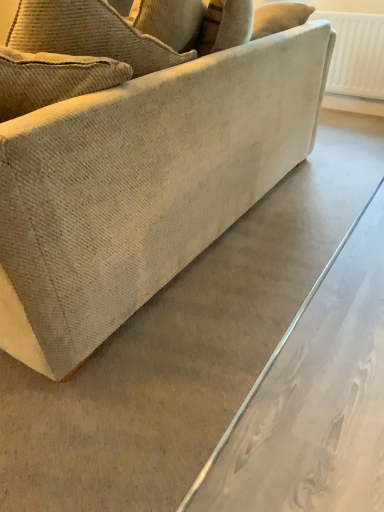
Locate an element on the screen. The width and height of the screenshot is (384, 512). white textured radiator at upper right is located at coordinates (356, 54).

The image size is (384, 512). What do you see at coordinates (356, 54) in the screenshot? I see `white textured radiator at upper right` at bounding box center [356, 54].

The height and width of the screenshot is (512, 384). What are the coordinates of `beige fabric couch at center` in the screenshot? It's located at pyautogui.click(x=142, y=162).

What do you see at coordinates (142, 162) in the screenshot? Image resolution: width=384 pixels, height=512 pixels. I see `beige fabric couch at center` at bounding box center [142, 162].

Image resolution: width=384 pixels, height=512 pixels. What are the coordinates of `white textured radiator at upper right` in the screenshot? It's located at (356, 54).

Can you confirm if beige fabric couch at center is positioned to the right of white textured radiator at upper right?

No.

Which is behind, beige fabric couch at center or white textured radiator at upper right?

white textured radiator at upper right is further from the camera.

Between point (310, 145) and point (381, 69), which one is positioned in front?

Point (310, 145)

From the image's perspective, is beige fabric couch at center under white textured radiator at upper right?

Yes.

From a real-world perspective, between beige fabric couch at center and white textured radiator at upper right, who is vertically lower?

In real-world perspective, white textured radiator at upper right is lower.

Between beige fabric couch at center and white textured radiator at upper right, which one has smaller width?

With smaller width is white textured radiator at upper right.

Can you confirm if beige fabric couch at center is shorter than white textured radiator at upper right?

No.

Does beige fabric couch at center have a smaller size compared to white textured radiator at upper right?

Incorrect, beige fabric couch at center is not smaller in size than white textured radiator at upper right.

Is beige fabric couch at center surrounding white textured radiator at upper right?

That's incorrect, white textured radiator at upper right is not inside beige fabric couch at center.

Is beige fabric couch at center next to white textured radiator at upper right?

beige fabric couch at center and white textured radiator at upper right are clearly separated.

Is beige fabric couch at center turned away from white textured radiator at upper right?

No, beige fabric couch at center's orientation is not away from white textured radiator at upper right.

How different are the orientations of beige fabric couch at center and white textured radiator at upper right in degrees?

The facing directions of beige fabric couch at center and white textured radiator at upper right are 90.9 degrees apart.

How much distance is there between beige fabric couch at center and white textured radiator at upper right?

beige fabric couch at center and white textured radiator at upper right are 5.60 feet apart.

This screenshot has height=512, width=384. I want to click on studio couch to the left of white textured radiator at upper right, so click(x=142, y=162).

Which object is positioned more to the left, white textured radiator at upper right or beige fabric couch at center?

beige fabric couch at center.

Considering the positions of objects white textured radiator at upper right and beige fabric couch at center in the image provided, who is in front, white textured radiator at upper right or beige fabric couch at center?

Positioned in front is beige fabric couch at center.

Does point (375, 52) lie in front of point (93, 197)?

That is False.

From the image's perspective, is white textured radiator at upper right positioned above or below beige fabric couch at center?

Based on their image positions, white textured radiator at upper right is located above beige fabric couch at center.

From a real-world perspective, is white textured radiator at upper right positioned above or below beige fabric couch at center?

white textured radiator at upper right is below beige fabric couch at center.

Between white textured radiator at upper right and beige fabric couch at center, which one has larger width?

Wider between the two is beige fabric couch at center.

Who is taller, white textured radiator at upper right or beige fabric couch at center?

beige fabric couch at center.

Which of these two, white textured radiator at upper right or beige fabric couch at center, is bigger?

beige fabric couch at center is bigger.

Is white textured radiator at upper right located outside beige fabric couch at center?

Yes, white textured radiator at upper right is outside of beige fabric couch at center.

Is white textured radiator at upper right placed right next to beige fabric couch at center?

white textured radiator at upper right and beige fabric couch at center are not in contact.

Is white textured radiator at upper right aimed at beige fabric couch at center?

Yes, white textured radiator at upper right is facing beige fabric couch at center.

What's the angular difference between white textured radiator at upper right and beige fabric couch at center's facing directions?

90.9 degrees.

Image resolution: width=384 pixels, height=512 pixels. I want to click on radiator directly beneath the beige fabric couch at center (from a real-world perspective), so click(x=356, y=54).

Locate an element on the screen. radiator behind the beige fabric couch at center is located at coordinates (356, 54).

In the image, there is a beige fabric couch at center. Where is `radiator below it (from a real-world perspective)`? radiator below it (from a real-world perspective) is located at coordinates (356, 54).